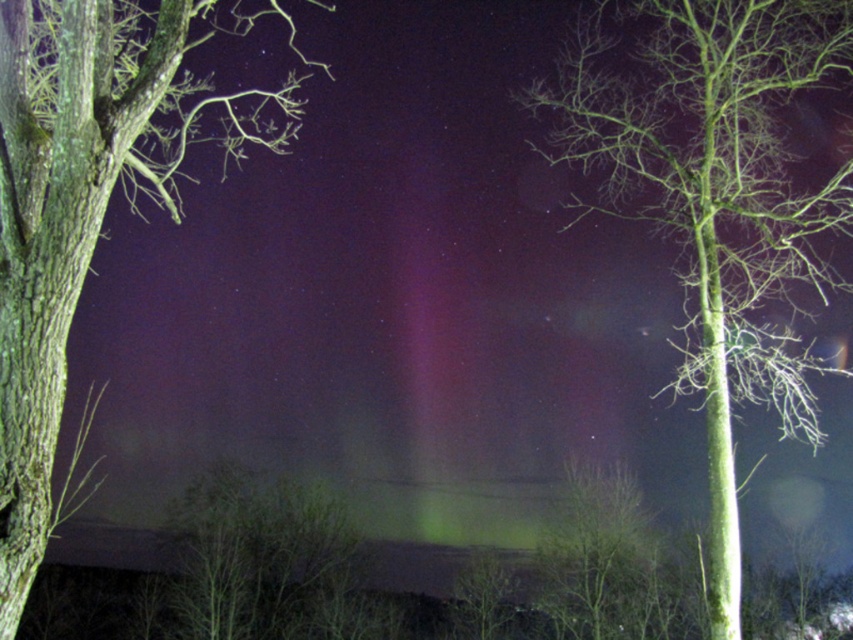
Question: Which object is positioned farthest from the green matte tree at center?

Choices:
 (A) smooth bark tree at left
 (B) green matte tree at right

Answer: (A)

Question: Does green matte tree at center have a larger size compared to smooth bark tree at left?

Choices:
 (A) no
 (B) yes

Answer: (A)

Question: Among these objects, which one is farthest from the camera?

Choices:
 (A) smooth bark tree at left
 (B) green matte tree at right
 (C) green matte tree at center

Answer: (B)

Question: Does green matte tree at center have a larger size compared to green matte tree at right?

Choices:
 (A) no
 (B) yes

Answer: (B)

Question: From the image, what is the correct spatial relationship of smooth bark tree at left in relation to green matte tree at right?

Choices:
 (A) left
 (B) right

Answer: (A)

Question: Which is nearer to the green matte tree at right?

Choices:
 (A) green matte tree at center
 (B) smooth bark tree at left

Answer: (A)